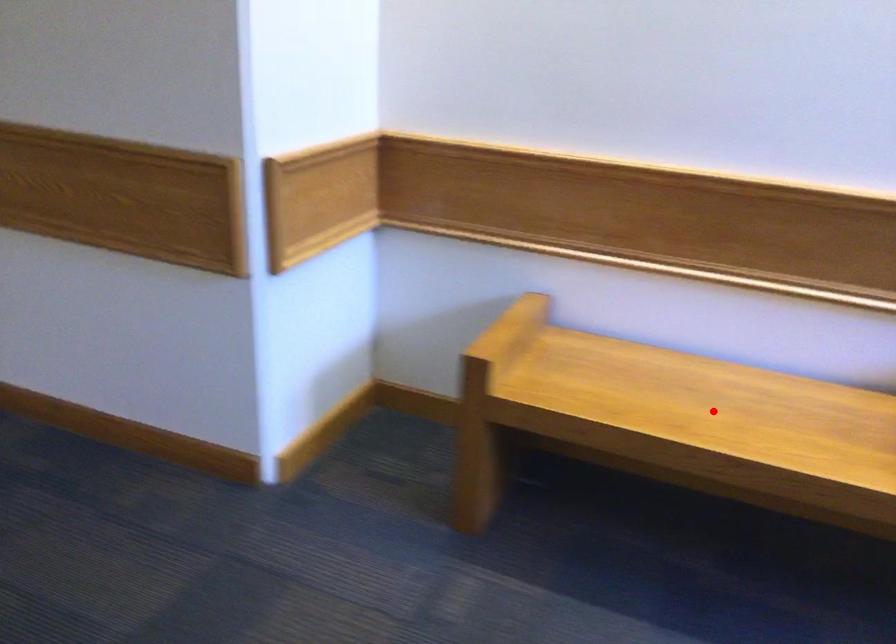
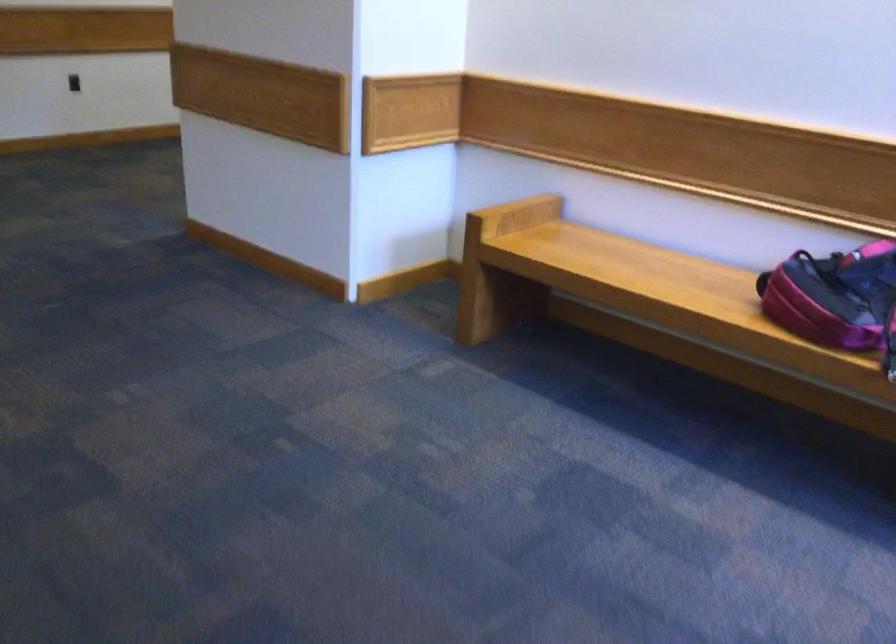
Find the pixel in the second image that matches the highlighted location in the first image.

(633, 270)